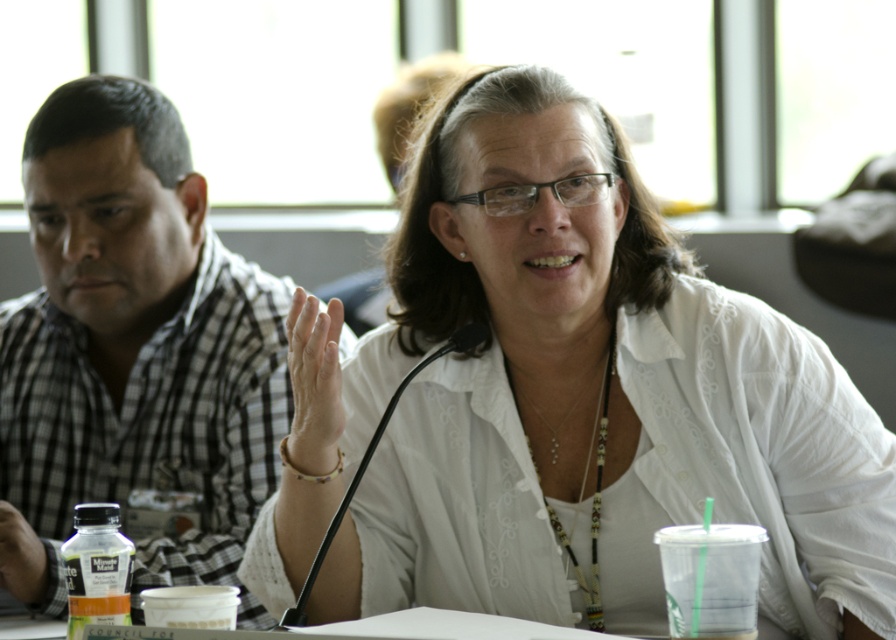
You are a photographer setting up for a group photo. You need to position two subjects wearing the white matte shirt at center and the checkered fabric shirt at left such that there is at least 24 inches between them. Based on the current setup shown in the image, will you need to adjust their positions to meet this requirement?

The white matte shirt at center is currently 23.85 inches from the checkered fabric shirt at left, which is just under the required 24 inches. Therefore, a slight adjustment is needed to ensure the distance meets the minimum requirement.

You are organizing a meeting and need to place a name tag on the table. The name tag must be placed to the right of the checkered fabric shirt at left. Where should you place it in relation to the translucent plastic bottle at lower left?

The checkered fabric shirt at left is to the left of the translucent plastic bottle at lower left. Therefore, placing the name tag to the right of the checkered fabric shirt at left would mean placing it to the right of the translucent plastic bottle at lower left as well.